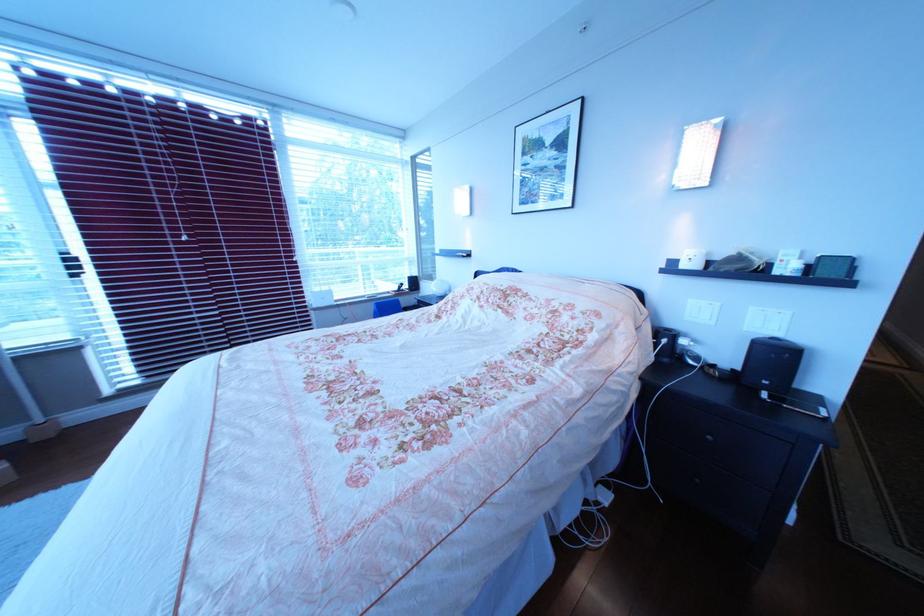
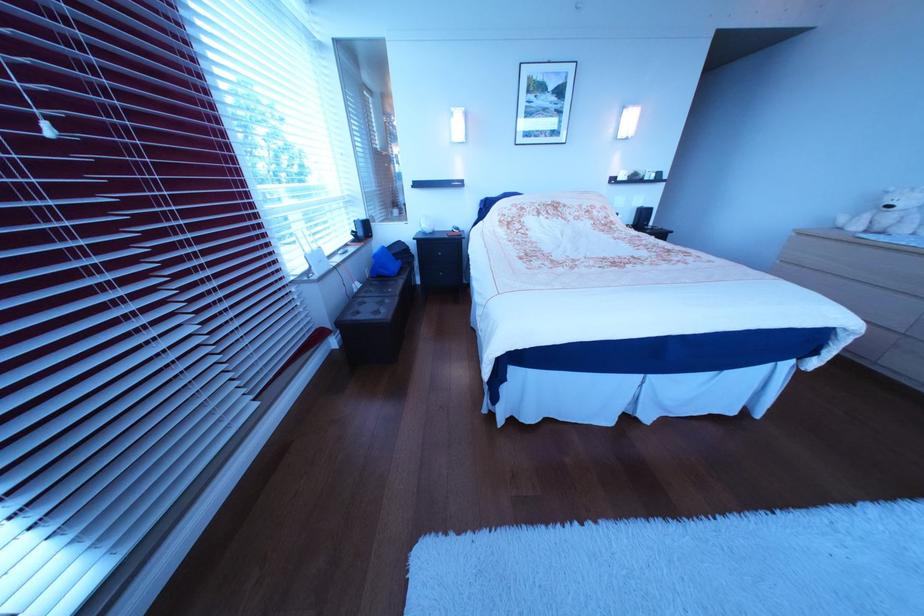
Question: I am providing you with two images of the same scene from different viewpoints. After the viewpoint changes to image2, which objects are now occluded?

Choices:
 (A) nightstand drawer handle
 (B) digital clock
 (C) orange machine button
 (D) white teddy bear

Answer: (B)